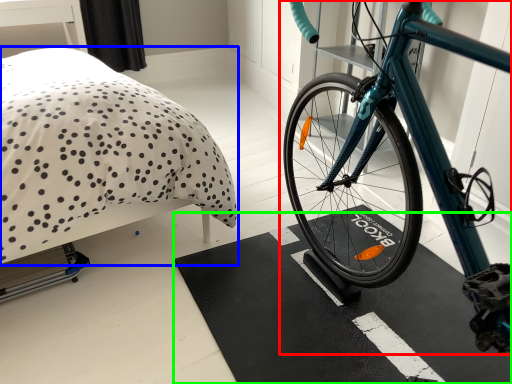
Question: Based on their relative distances, which object is farther from bicycle (highlighted by a red box)? Choose from bed (highlighted by a blue box) and bath mat (highlighted by a green box).

Choices:
 (A) bed
 (B) bath mat

Answer: (A)